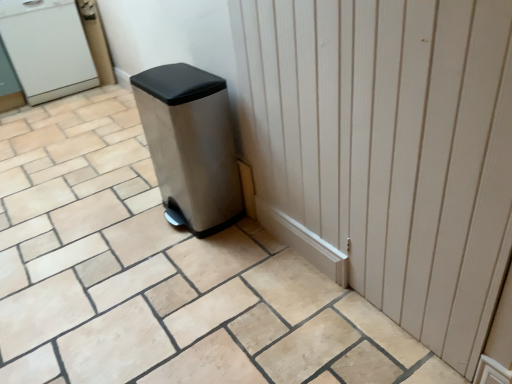
The width and height of the screenshot is (512, 384). Identify the location of free space in front of stainless steel trash can at center. (193, 268).